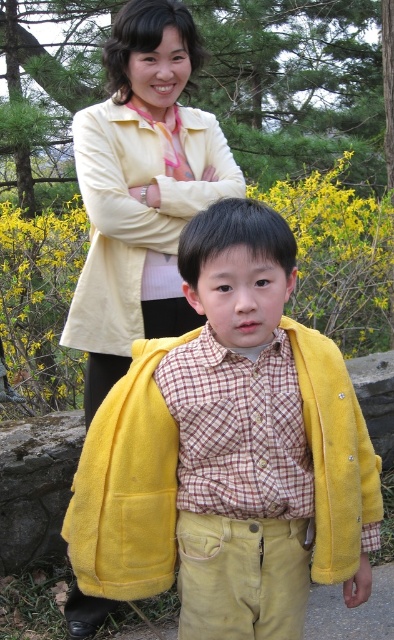
Does point (364, 504) come closer to viewer compared to point (154, 35)?

That is True.

Where is `yellow fleece jacket at center`? yellow fleece jacket at center is located at coordinates (230, 451).